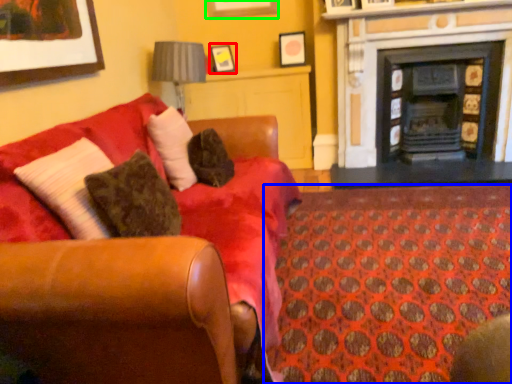
Question: Considering the real-world distances, which object is closest to picture frame (highlighted by a red box)? pattern (highlighted by a blue box) or picture frame (highlighted by a green box).

Choices:
 (A) pattern
 (B) picture frame

Answer: (B)